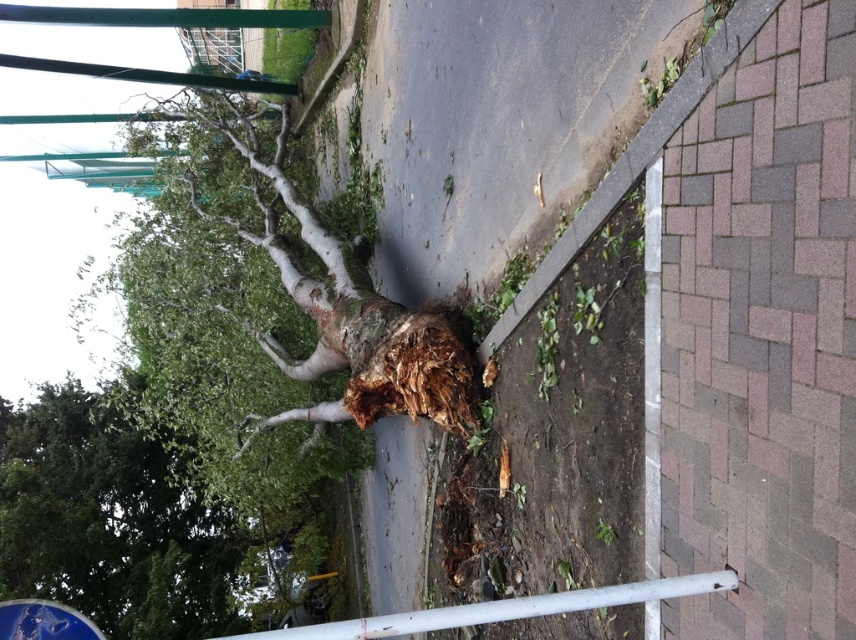
You are a pedestrian trying to cross the road and see the white matte rail at lower center and the blue glossy street sign at lower left. Which object is positioned higher relative to the other?

The white matte rail at lower center is located above the blue glossy street sign at lower left, so it is positioned higher.

You are a pedestrian trying to cross the road and see the green leafy tree at lower left and the white matte rail at lower center. Which object is closer to you?

The green leafy tree at lower left is closer to you because the white matte rail at lower center is behind it.

You are a pedestrian trying to cross the road. You see the green leafy tree at lower left and the white matte rail at lower center. Which object is closer to your left side when facing the road?

The green leafy tree at lower left is to the left of the white matte rail at lower center, so when facing the road, the green leafy tree at lower left is closer to your left side.